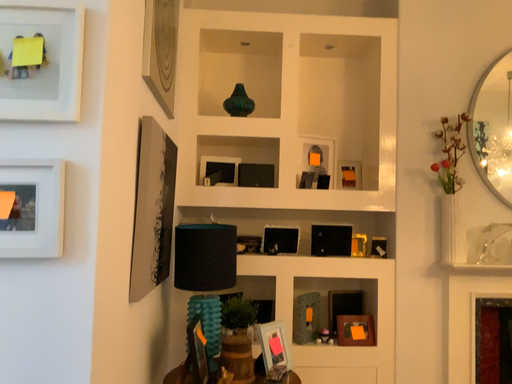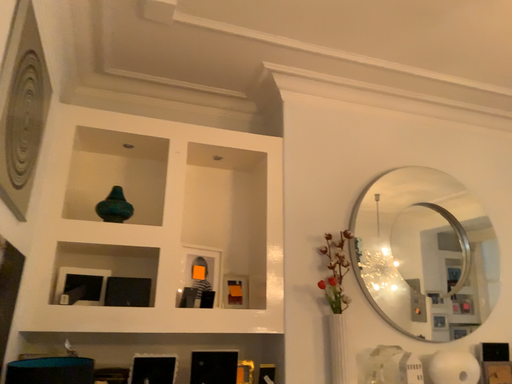
Question: How did the camera likely rotate when shooting the video?

Choices:
 (A) rotated downward
 (B) rotated upward

Answer: (B)